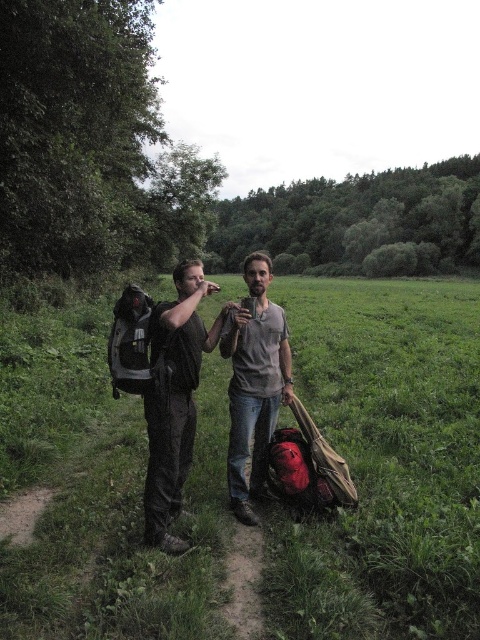
Question: Does matte black backpack at left appear under matte gray shirt at center?

Choices:
 (A) yes
 (B) no

Answer: (B)

Question: Among these objects, which one is nearest to the camera?

Choices:
 (A) matte gray shirt at center
 (B) matte black backpack at left

Answer: (B)

Question: In this image, where is matte black backpack at left located relative to matte black backpack at center?

Choices:
 (A) right
 (B) left

Answer: (A)

Question: Which point is farther to the camera?

Choices:
 (A) matte black backpack at left
 (B) matte gray shirt at center
 (C) matte black backpack at center

Answer: (B)

Question: Which object appears farthest from the camera in this image?

Choices:
 (A) matte gray shirt at center
 (B) matte black backpack at center

Answer: (A)

Question: Observing the image, what is the correct spatial positioning of matte black backpack at left in reference to matte black backpack at center?

Choices:
 (A) right
 (B) left

Answer: (A)